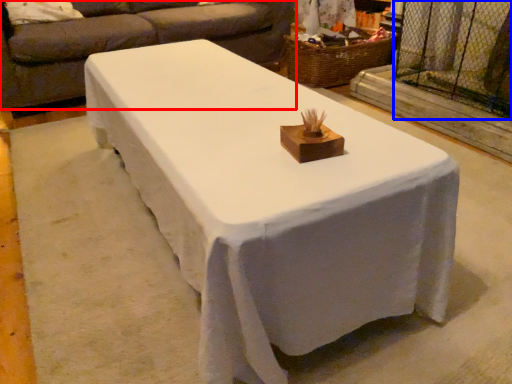
Question: Among these objects, which one is farthest to the camera, studio couch (highlighted by a red box) or screen door (highlighted by a blue box)?

Choices:
 (A) studio couch
 (B) screen door

Answer: (A)